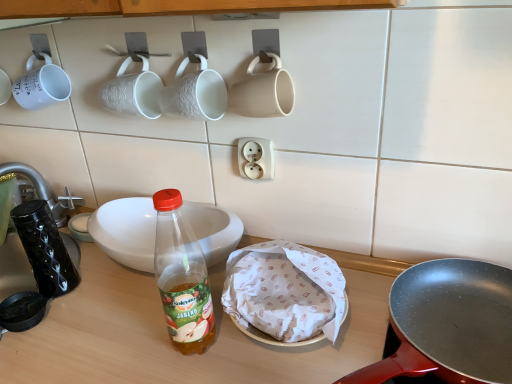
Locate an element on the screen. The height and width of the screenshot is (384, 512). vacant space situated on the left part of translucent plastic bottle at center is located at coordinates (117, 334).